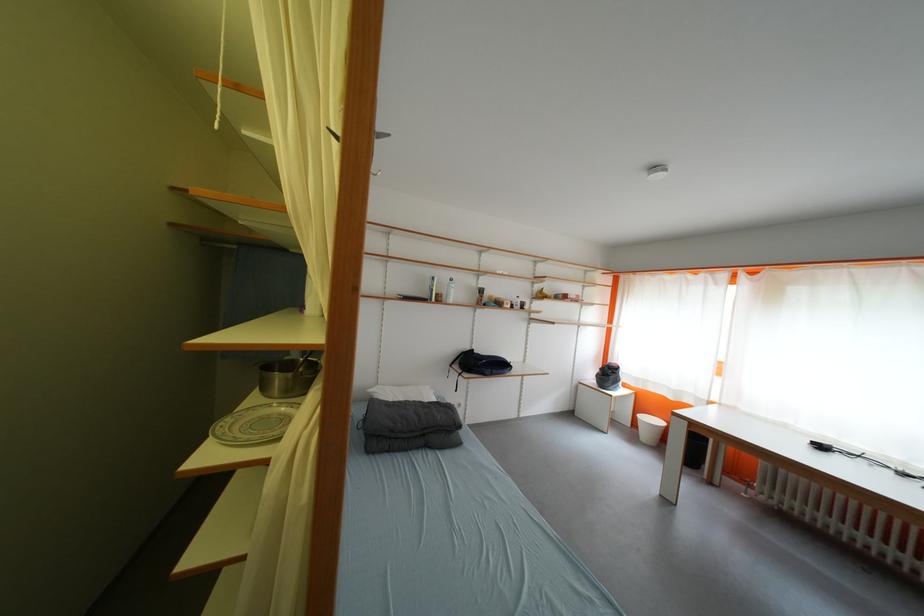
Image resolution: width=924 pixels, height=616 pixels. Identify the location of white pull cord. (220, 66).